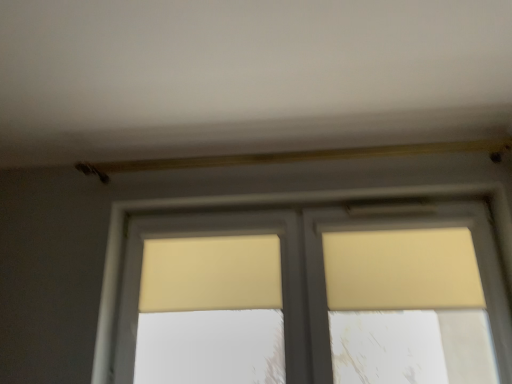
Describe the element at coordinates (313, 270) in the screenshot. I see `matte yellow window at center` at that location.

What is the approximate width of matte yellow window at center?

matte yellow window at center is 6.91 inches wide.

In order to face beige fabric curtain at center, arranged as the 1th curtain when viewed from the left, should I rotate leftwards or rightwards?

Turn left by 5.422 degrees to look at beige fabric curtain at center, arranged as the 1th curtain when viewed from the left.

Where is `beige fabric curtain at upper right, the 2th curtain from the left`? beige fabric curtain at upper right, the 2th curtain from the left is located at coordinates (402, 270).

Locate an element on the screen. This screenshot has width=512, height=384. matte yellow window at center is located at coordinates (313, 270).

Is beige fabric curtain at center, arranged as the 1th curtain when viewed from the left, not inside beige fabric curtain at upper right, the 2th curtain from the left?

Absolutely, beige fabric curtain at center, arranged as the 1th curtain when viewed from the left, is external to beige fabric curtain at upper right, the 2th curtain from the left.

Considering the sizes of objects beige fabric curtain at center, the 2th curtain positioned from the right, and beige fabric curtain at upper right, which is counted as the first curtain, starting from the right, in the image provided, who is thinner, beige fabric curtain at center, the 2th curtain positioned from the right, or beige fabric curtain at upper right, which is counted as the first curtain, starting from the right,?

beige fabric curtain at center, the 2th curtain positioned from the right, is thinner.

From the image's perspective, is beige fabric curtain at center, arranged as the 1th curtain when viewed from the left, beneath beige fabric curtain at upper right, the 2th curtain from the left?

Correct, beige fabric curtain at center, arranged as the 1th curtain when viewed from the left, appears lower than beige fabric curtain at upper right, the 2th curtain from the left, in the image.

Is the surface of beige fabric curtain at center, the 2th curtain positioned from the right, in direct contact with beige fabric curtain at upper right, which is counted as the first curtain, starting from the right?

There is a gap between beige fabric curtain at center, the 2th curtain positioned from the right, and beige fabric curtain at upper right, which is counted as the first curtain, starting from the right.

Can you confirm if beige fabric curtain at upper right, which is counted as the first curtain, starting from the right, is shorter than matte yellow window at center?

Yes, beige fabric curtain at upper right, which is counted as the first curtain, starting from the right, is shorter than matte yellow window at center.

How far apart are beige fabric curtain at upper right, which is counted as the first curtain, starting from the right, and matte yellow window at center?

beige fabric curtain at upper right, which is counted as the first curtain, starting from the right, is 7.89 inches away from matte yellow window at center.

Is beige fabric curtain at upper right, the 2th curtain from the left, in front of or behind matte yellow window at center in the image?

Clearly, beige fabric curtain at upper right, the 2th curtain from the left, is behind matte yellow window at center.

In terms of width, does beige fabric curtain at upper right, which is counted as the first curtain, starting from the right, look wider or thinner when compared to matte yellow window at center?

In the image, beige fabric curtain at upper right, which is counted as the first curtain, starting from the right, appears to be more narrow than matte yellow window at center.

Is beige fabric curtain at upper right, which is counted as the first curtain, starting from the right, to the right of beige fabric curtain at center, the 2th curtain positioned from the right, from the viewer's perspective?

Indeed, beige fabric curtain at upper right, which is counted as the first curtain, starting from the right, is positioned on the right side of beige fabric curtain at center, the 2th curtain positioned from the right.

From the image's perspective, which one is positioned lower, beige fabric curtain at upper right, the 2th curtain from the left, or beige fabric curtain at center, the 2th curtain positioned from the right?

beige fabric curtain at center, the 2th curtain positioned from the right.

Which is more to the right, matte yellow window at center or beige fabric curtain at center, the 2th curtain positioned from the right?

Positioned to the right is matte yellow window at center.

Which object is closer to the camera, matte yellow window at center or beige fabric curtain at center, the 2th curtain positioned from the right?

matte yellow window at center is more forward.

You are a GUI agent. You are given a task and a screenshot of the screen. Output one action in this format:
    pyautogui.click(x=<x>, y=<y>)
    Task: Click on the window below the beige fabric curtain at center, the 2th curtain positioned from the right (from a real-world perspective)
    
    Given the screenshot: What is the action you would take?
    pyautogui.click(x=313, y=270)

Does matte yellow window at center have a lesser width compared to beige fabric curtain at center, arranged as the 1th curtain when viewed from the left?

In fact, matte yellow window at center might be wider than beige fabric curtain at center, arranged as the 1th curtain when viewed from the left.

Looking at this image, how much distance is there between matte yellow window at center and beige fabric curtain at upper right, the 2th curtain from the left?

They are 7.89 inches apart.

Does matte yellow window at center have a larger size compared to beige fabric curtain at upper right, which is counted as the first curtain, starting from the right?

Indeed, matte yellow window at center has a larger size compared to beige fabric curtain at upper right, which is counted as the first curtain, starting from the right.

From the image's perspective, which one is positioned higher, matte yellow window at center or beige fabric curtain at upper right, the 2th curtain from the left?

From the image's view, beige fabric curtain at upper right, the 2th curtain from the left, is above.

Which object is further away from the camera, beige fabric curtain at center, arranged as the 1th curtain when viewed from the left, or matte yellow window at center?

beige fabric curtain at center, arranged as the 1th curtain when viewed from the left, is further from the camera.

Is beige fabric curtain at center, the 2th curtain positioned from the right, not within matte yellow window at center?

No, beige fabric curtain at center, the 2th curtain positioned from the right, is not entirely external to matte yellow window at center.

From the image's perspective, is beige fabric curtain at center, arranged as the 1th curtain when viewed from the left, below matte yellow window at center?

Incorrect, from the image's perspective, beige fabric curtain at center, arranged as the 1th curtain when viewed from the left, is higher than matte yellow window at center.

The height and width of the screenshot is (384, 512). Identify the location of curtain on the right of beige fabric curtain at center, the 2th curtain positioned from the right. (402, 270).

From the image's perspective, which curtain is the 2nd one above the matte yellow window at center? Please provide its 2D coordinates.

[(402, 270)]

When comparing their distances from beige fabric curtain at upper right, which is counted as the first curtain, starting from the right, does matte yellow window at center or beige fabric curtain at center, the 2th curtain positioned from the right, seem closer?

Based on the image, matte yellow window at center appears to be nearer to beige fabric curtain at upper right, which is counted as the first curtain, starting from the right.

In the scene shown: When comparing their distances from beige fabric curtain at center, arranged as the 1th curtain when viewed from the left, does beige fabric curtain at upper right, which is counted as the first curtain, starting from the right, or matte yellow window at center seem further?

beige fabric curtain at upper right, which is counted as the first curtain, starting from the right, is further to beige fabric curtain at center, arranged as the 1th curtain when viewed from the left.

Estimate the real-world distances between objects in this image. Which object is further from matte yellow window at center, beige fabric curtain at upper right, which is counted as the first curtain, starting from the right, or beige fabric curtain at center, arranged as the 1th curtain when viewed from the left?

beige fabric curtain at upper right, which is counted as the first curtain, starting from the right, lies further to matte yellow window at center than the other object.

Based on their spatial positions, is beige fabric curtain at center, arranged as the 1th curtain when viewed from the left, or matte yellow window at center closer to beige fabric curtain at upper right, which is counted as the first curtain, starting from the right?

matte yellow window at center lies closer to beige fabric curtain at upper right, which is counted as the first curtain, starting from the right, than the other object.

Based on their spatial positions, is beige fabric curtain at center, the 2th curtain positioned from the right, or beige fabric curtain at upper right, which is counted as the first curtain, starting from the right, closer to matte yellow window at center?

beige fabric curtain at center, the 2th curtain positioned from the right, lies closer to matte yellow window at center than the other object.

Based on their spatial positions, is matte yellow window at center or beige fabric curtain at upper right, the 2th curtain from the left, further from beige fabric curtain at center, the 2th curtain positioned from the right?

beige fabric curtain at upper right, the 2th curtain from the left, lies further to beige fabric curtain at center, the 2th curtain positioned from the right, than the other object.

What are the coordinates of `window between beige fabric curtain at center, the 2th curtain positioned from the right, and beige fabric curtain at upper right, the 2th curtain from the left, from left to right` in the screenshot? It's located at (313, 270).